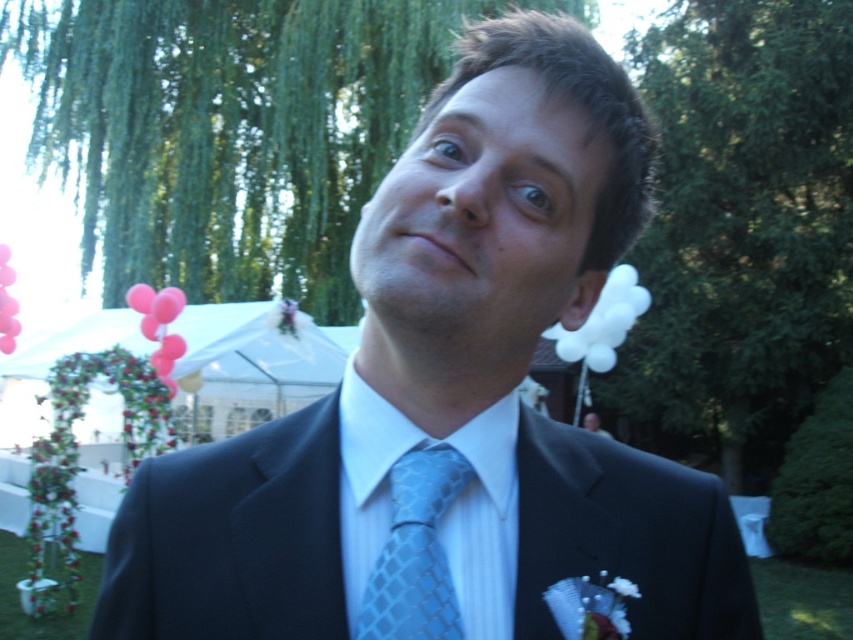
Question: Does black satin suit at center have a smaller size compared to light blue textured tie at center?

Choices:
 (A) no
 (B) yes

Answer: (A)

Question: Considering the relative positions of black satin suit at center and light blue textured tie at center in the image provided, where is black satin suit at center located with respect to light blue textured tie at center?

Choices:
 (A) right
 (B) left

Answer: (A)

Question: Does black satin suit at center have a lesser width compared to light blue textured tie at center?

Choices:
 (A) no
 (B) yes

Answer: (A)

Question: Which point is farther from the camera taking this photo?

Choices:
 (A) (437, 561)
 (B) (276, 460)

Answer: (B)